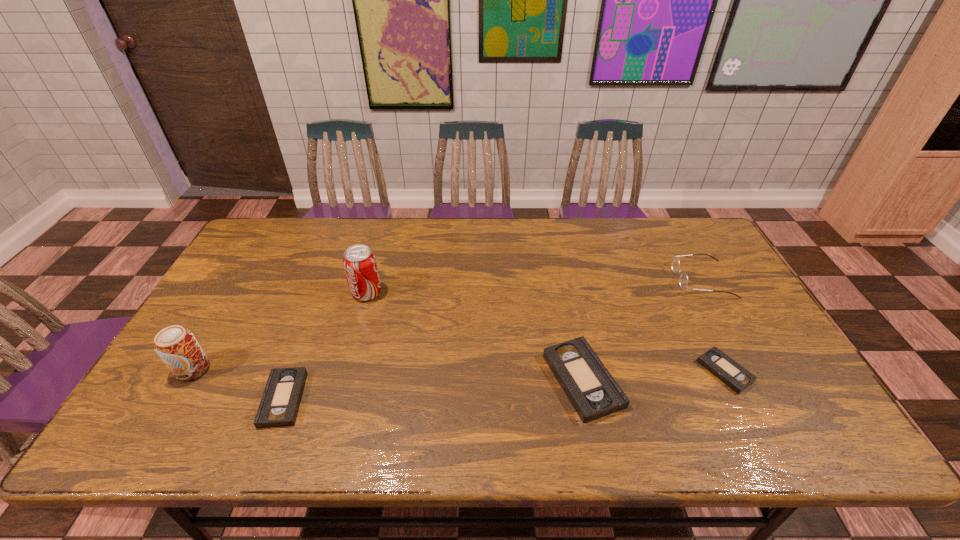
Point out which object is positioned as the second nearest to the shortest videotape. Please provide its 2D coordinates. Your answer should be formatted as a tuple, i.e. [(x, y)], where the tuple contains the x and y coordinates of a point satisfying the conditions above.

[(591, 389)]

Identify which object is located as the fourth nearest to the soda. Please provide its 2D coordinates. Your answer should be formatted as a tuple, i.e. [(x, y)], where the tuple contains the x and y coordinates of a point satisfying the conditions above.

[(736, 377)]

At what (x,y) coordinates should I click in order to perform the action: click on videotape that is the second closest one to the leftmost videotape. Please return your answer as a coordinate pair (x, y). This screenshot has width=960, height=540. Looking at the image, I should click on (736, 377).

Locate an element on the screen. This screenshot has width=960, height=540. videotape that is the second closest to the leftmost object is located at coordinates (591, 389).

Where is `vacant space that satisfies the following two spatial constraints: 1. on the back side of the second videotape from right to left; 2. on the left side of the second tallest videotape`? This screenshot has width=960, height=540. vacant space that satisfies the following two spatial constraints: 1. on the back side of the second videotape from right to left; 2. on the left side of the second tallest videotape is located at coordinates (290, 380).

Find the location of a particular element. The height and width of the screenshot is (540, 960). free space that satisfies the following two spatial constraints: 1. on the back side of the leftmost videotape; 2. on the right side of the shortest videotape is located at coordinates (294, 372).

Locate an element on the screen. Image resolution: width=960 pixels, height=540 pixels. free spot that satisfies the following two spatial constraints: 1. on the front side of the tallest videotape; 2. on the left side of the third object from left to right is located at coordinates (343, 380).